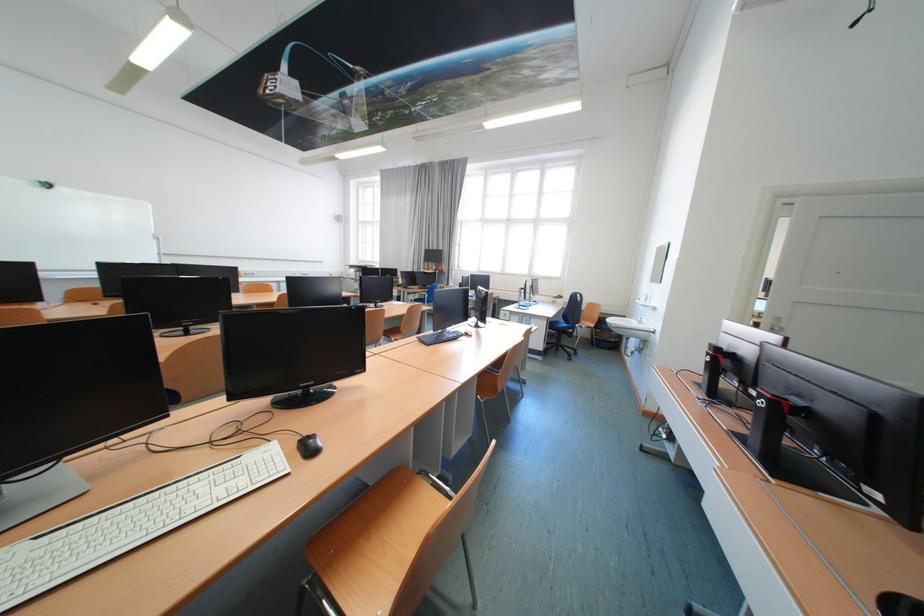
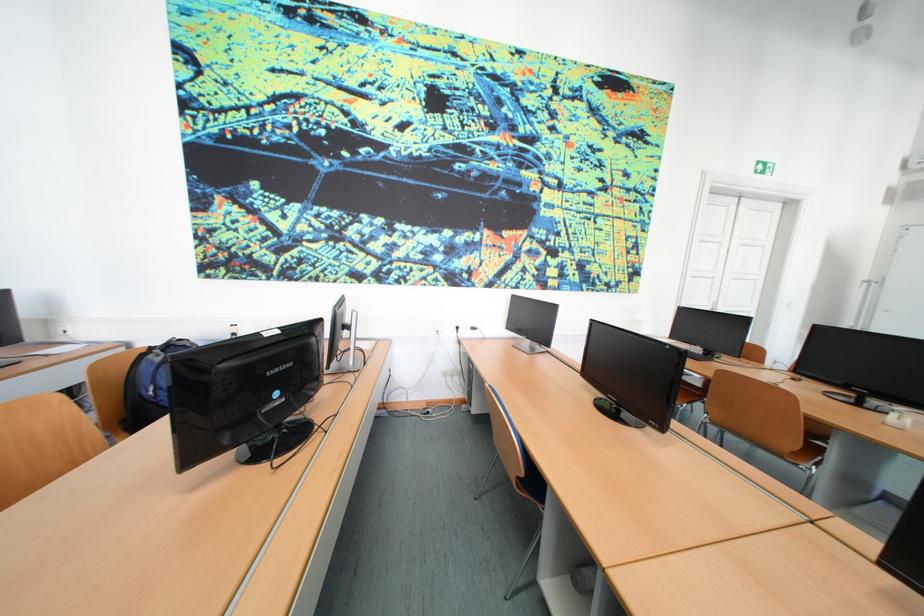
Question: I am providing you with two images of the same scene from different viewpoints. Please identify which objects are invisible in image2.

Choices:
 (A) brown chair sitting surface
 (B) white computer keyboard
 (C) blue lanyard
 (D) wall power outlet

Answer: (B)